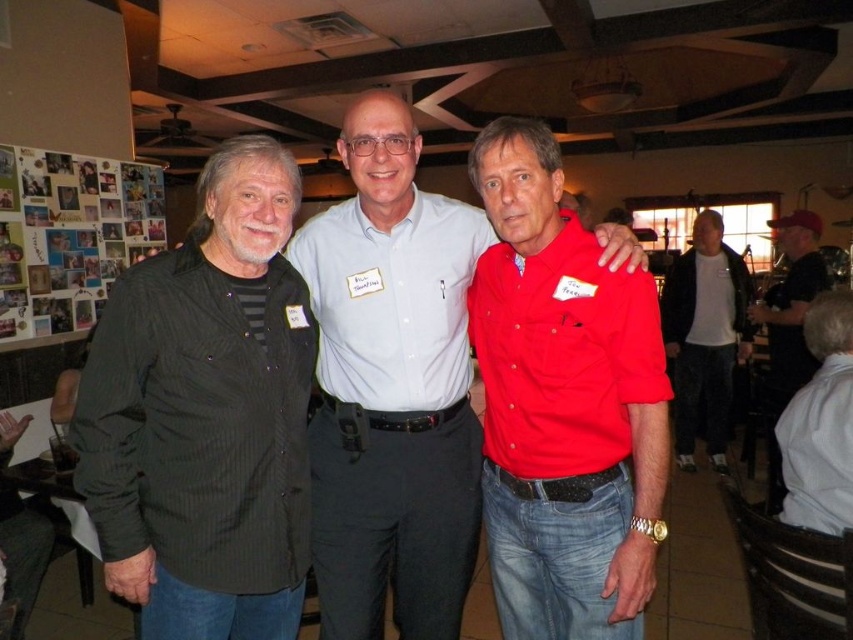
Question: Which point appears closest to the camera in this image?

Choices:
 (A) (531, 516)
 (B) (355, 486)
 (C) (718, 353)
 (D) (474, 243)

Answer: (A)

Question: Is light blue button-down shirt at center above red fabric cap at right?

Choices:
 (A) yes
 (B) no

Answer: (A)

Question: Which object appears farthest from the camera in this image?

Choices:
 (A) matte red shirt at center
 (B) black textured shirt at center

Answer: (B)

Question: Can you confirm if black textured shirt at center is positioned below white matte t-shirt at center-right?

Choices:
 (A) no
 (B) yes

Answer: (B)

Question: Observing the image, what is the correct spatial positioning of matte red shirt at center in reference to white matte shirt at center?

Choices:
 (A) above
 (B) below

Answer: (B)

Question: Based on their relative distances, which object is nearer to the red fabric cap at right?

Choices:
 (A) black textured shirt at left
 (B) matte red shirt at center

Answer: (B)